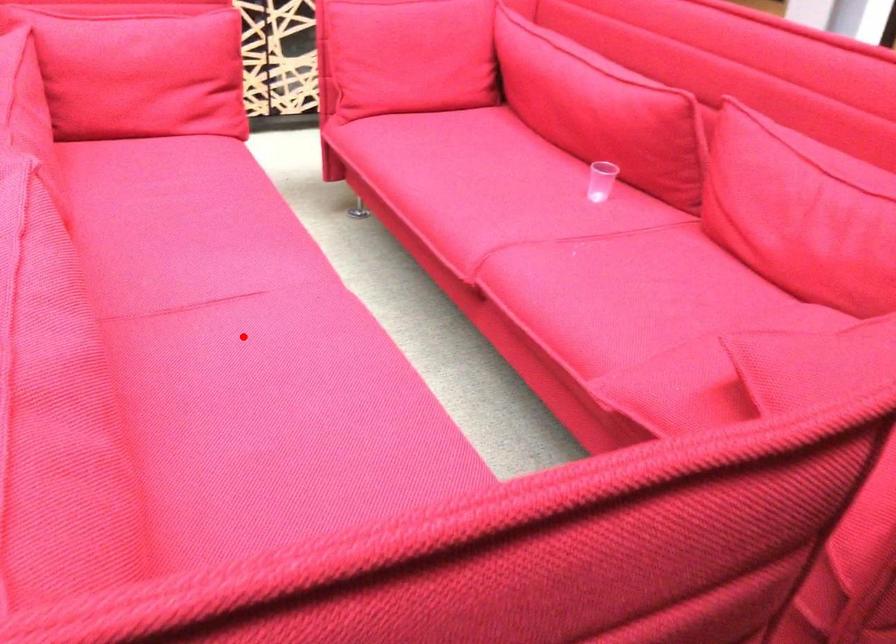
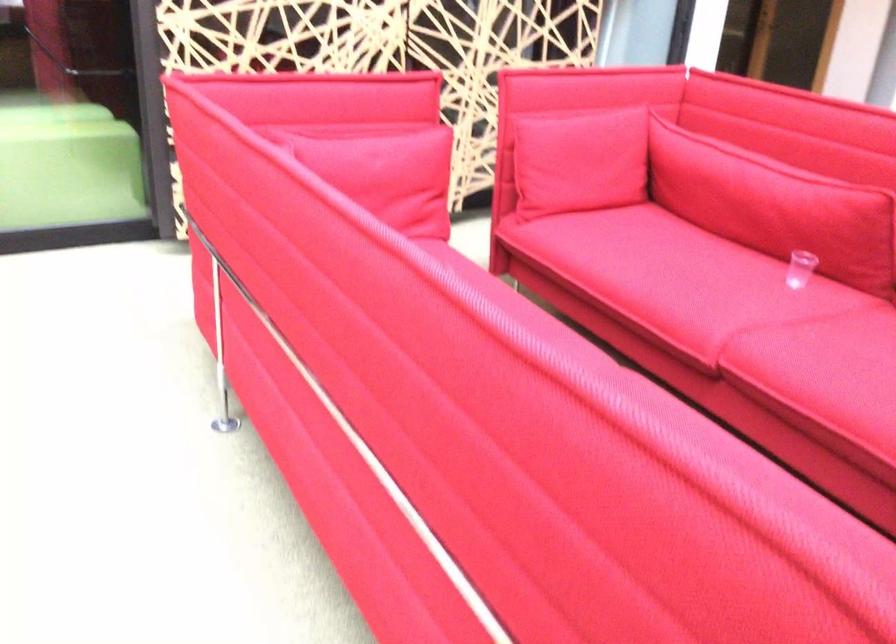
Question: I am providing you with two images of the same scene from different viewpoints. A red point is marked on the first image. Can you still see the location of the red point in image 2?

Choices:
 (A) Yes
 (B) No

Answer: (B)